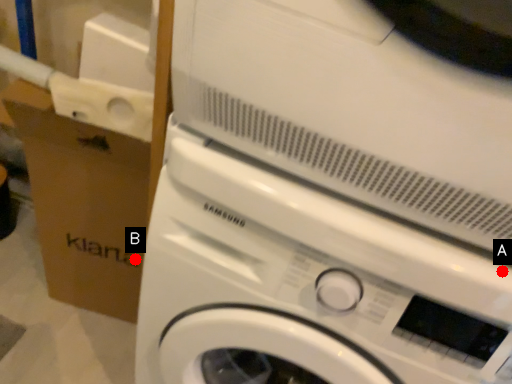
Question: Two points are circled on the image, labeled by A and B beside each circle. Which point appears closest to the camera in this image?

Choices:
 (A) A is closer
 (B) B is closer

Answer: (A)